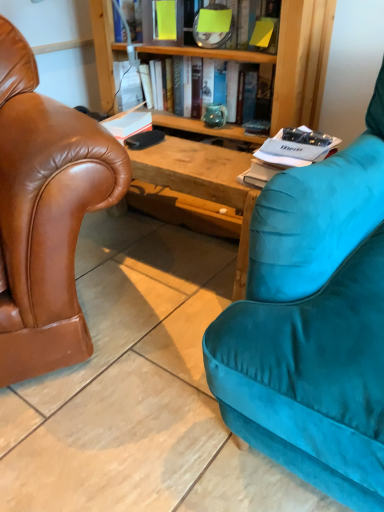
Question: Is yellow paper at upper center, the 4th book when ordered from bottom to top, taller or shorter than matte ceramic vase at center?

Choices:
 (A) tall
 (B) short

Answer: (A)

Question: Relative to matte ceramic vase at center, is yellow paper at upper center, which is the first book in top-to-bottom order, in front or behind?

Choices:
 (A) behind
 (B) front

Answer: (B)

Question: Based on their relative distances, which object is farther from the yellow paper at upper center, which is the first book in top-to-bottom order?

Choices:
 (A) matte green vase at center, the 3th book when ordered from bottom to top
 (B) white paper at right, the first book when ordered from bottom to top
 (C) white matte book at center, which appears as the 3th book when viewed from the top
 (D) matte ceramic vase at center

Answer: (B)

Question: Based on their relative distances, which object is nearer to the matte ceramic vase at center?

Choices:
 (A) matte green vase at center, the 3th book when ordered from bottom to top
 (B) white matte book at center, which appears as the 3th book when viewed from the top
 (C) white paper at right, the first book when ordered from bottom to top
 (D) yellow paper at upper center, which is the first book in top-to-bottom order

Answer: (A)